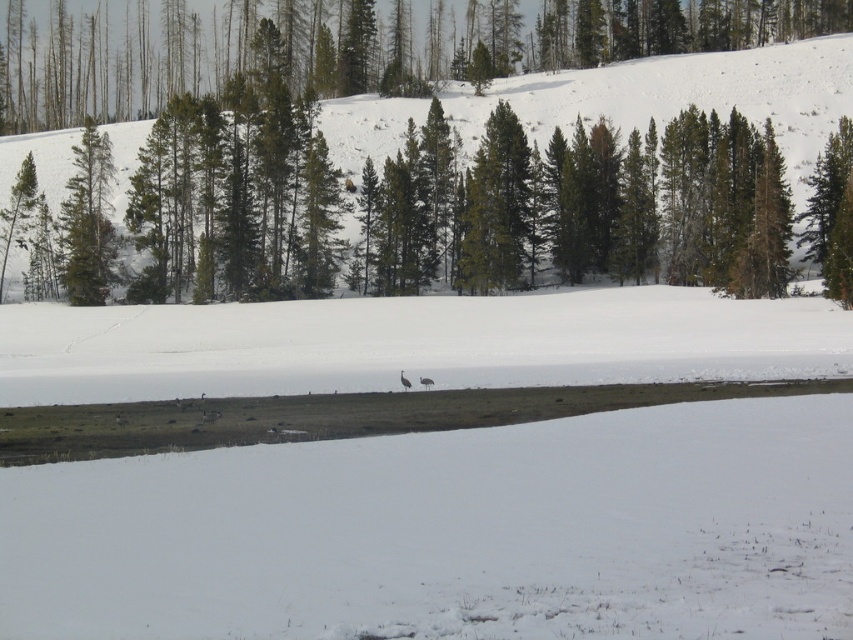
Is green matte tree at upper center taller than green matte trees at center?

No.

In the scene shown: Measure the distance between point (573, 54) and camera.

167.31 meters

Is point (592, 1) more distant than point (744, 93)?

Yes, it is behind point (744, 93).

Locate an element on the screen. green matte tree at upper center is located at coordinates (111, 61).